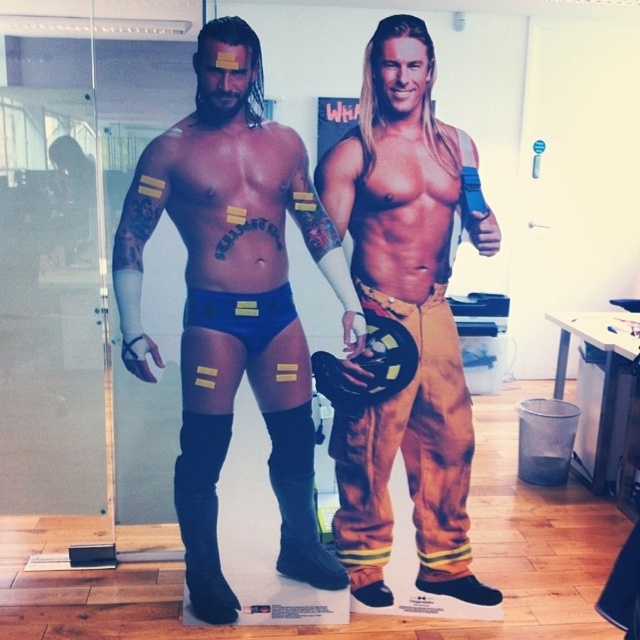
Question: Does matte blue shorts at center have a greater width compared to black suede boot at lower left?

Choices:
 (A) no
 (B) yes

Answer: (B)

Question: Considering the relative positions of matte blue shorts at center and matte orange pants at center in the image provided, where is matte blue shorts at center located with respect to matte orange pants at center?

Choices:
 (A) above
 (B) below

Answer: (B)

Question: Which point appears closest to the camera in this image?

Choices:
 (A) (321, 572)
 (B) (294, 426)
 (C) (216, 472)

Answer: (B)

Question: Which object is farther from the camera taking this photo?

Choices:
 (A) black suede boot at lower left
 (B) black suede boot at lower center
 (C) matte blue shorts at center
 (D) matte orange pants at center

Answer: (B)

Question: Observing the image, what is the correct spatial positioning of black suede boot at lower left in reference to black suede boot at lower center?

Choices:
 (A) right
 (B) left

Answer: (B)

Question: Which object is positioned closest to the matte orange pants at center?

Choices:
 (A) black suede boot at lower left
 (B) matte blue shorts at center

Answer: (B)